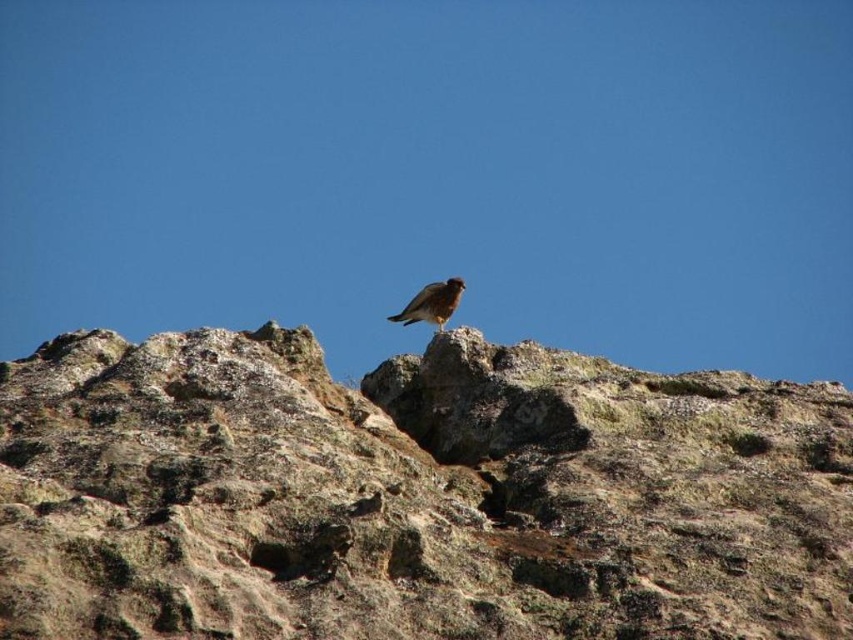
Between point (786, 500) and point (440, 301), which one is positioned in front?

Positioned in front is point (786, 500).

Is brown rough rock at center positioned behind brown feathered bird at upper center?

That is False.

The height and width of the screenshot is (640, 853). Find the location of `brown rough rock at center`. brown rough rock at center is located at coordinates (413, 493).